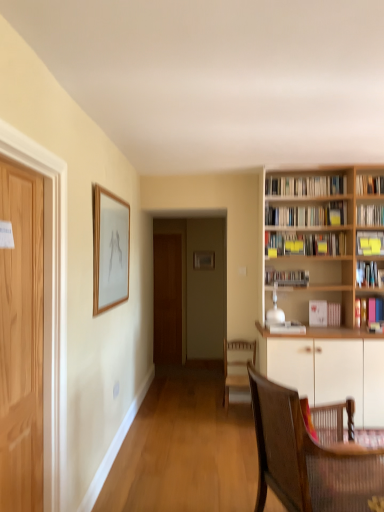
Locate an element on the screen. This screenshot has width=384, height=512. free region under white glossy book at lower center, acting as the 9th book starting from the top (from a real-world perspective) is located at coordinates (291, 328).